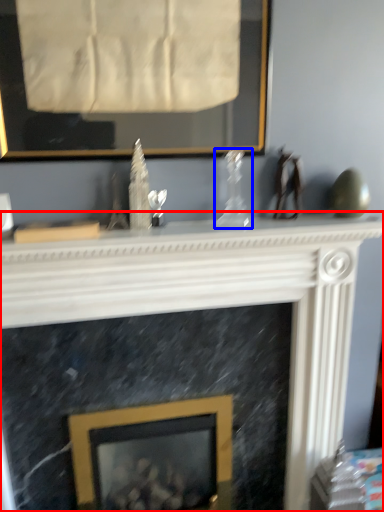
Question: Which object is further to the camera taking this photo, fireplace (highlighted by a red box) or glass vase (highlighted by a blue box)?

Choices:
 (A) fireplace
 (B) glass vase

Answer: (B)